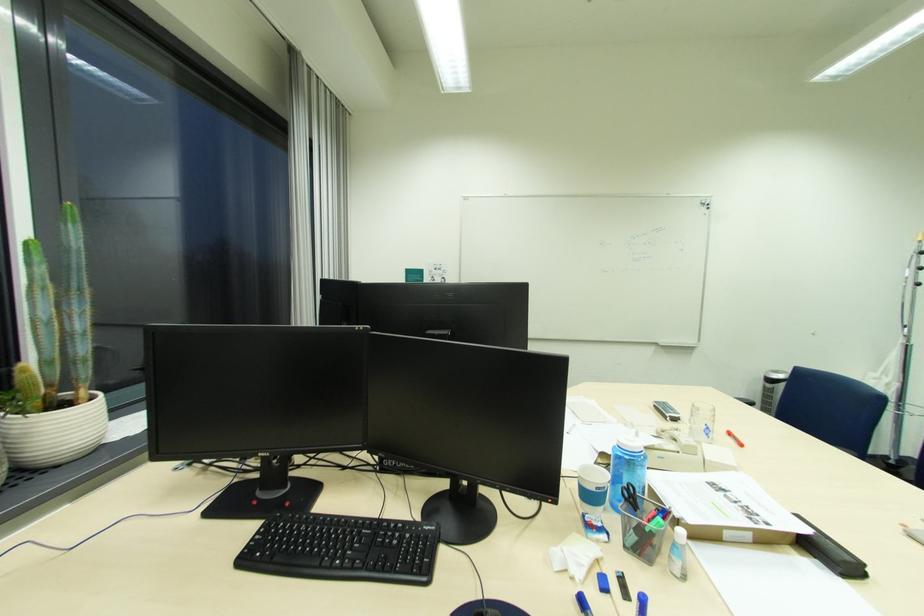
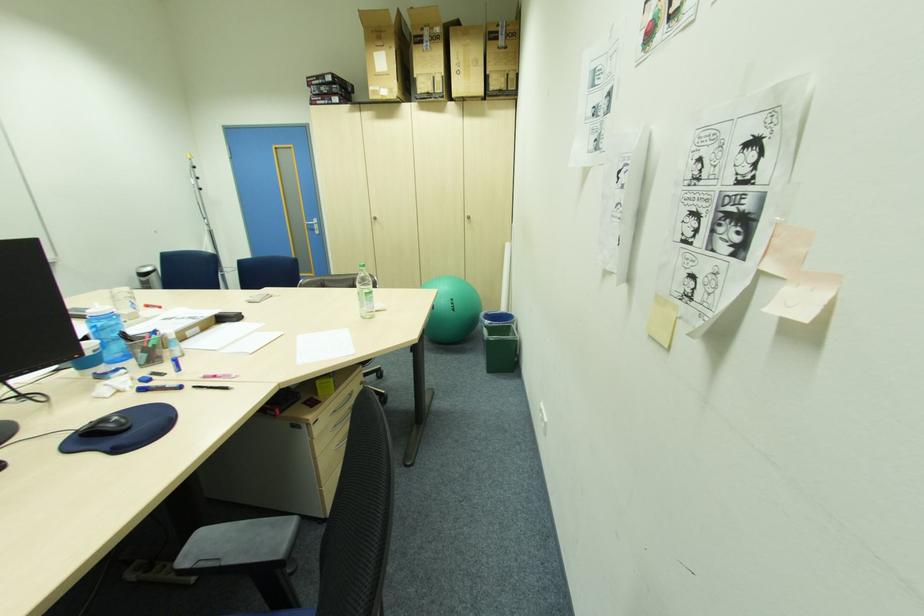
The first image is from the beginning of the video and the second image is from the end. How did the camera likely rotate when shooting the video?

The rotation direction of the camera is right-down.